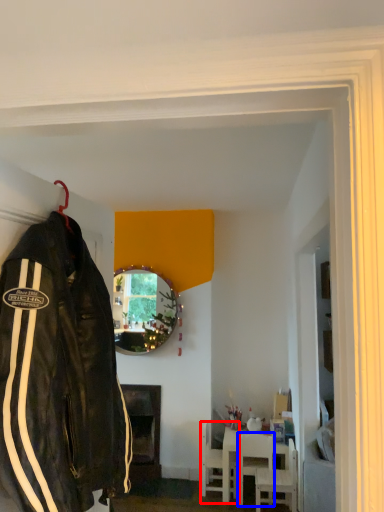
Question: Among these objects, which one is farthest to the camera, chair (highlighted by a red box) or chair (highlighted by a blue box)?

Choices:
 (A) chair
 (B) chair

Answer: (A)